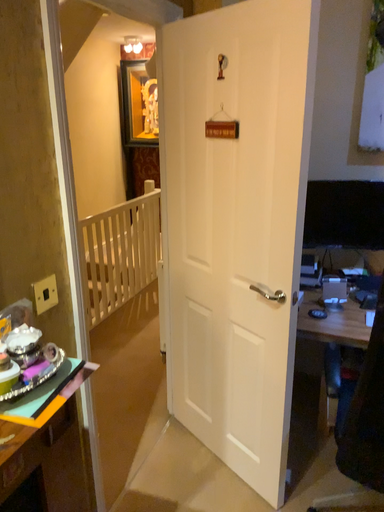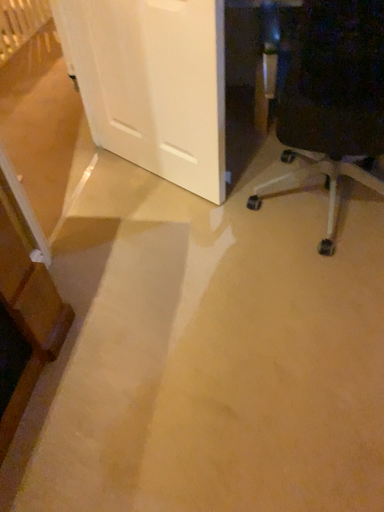
Question: Which way did the camera rotate in the video?

Choices:
 (A) rotated downward
 (B) rotated upward

Answer: (A)